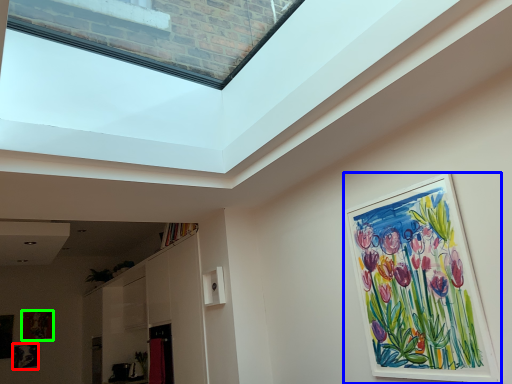
Question: Which object is the closest to the picture frame (highlighted by a red box)? Choose among these: picture frame (highlighted by a blue box) or picture frame (highlighted by a green box).

Choices:
 (A) picture frame
 (B) picture frame

Answer: (B)